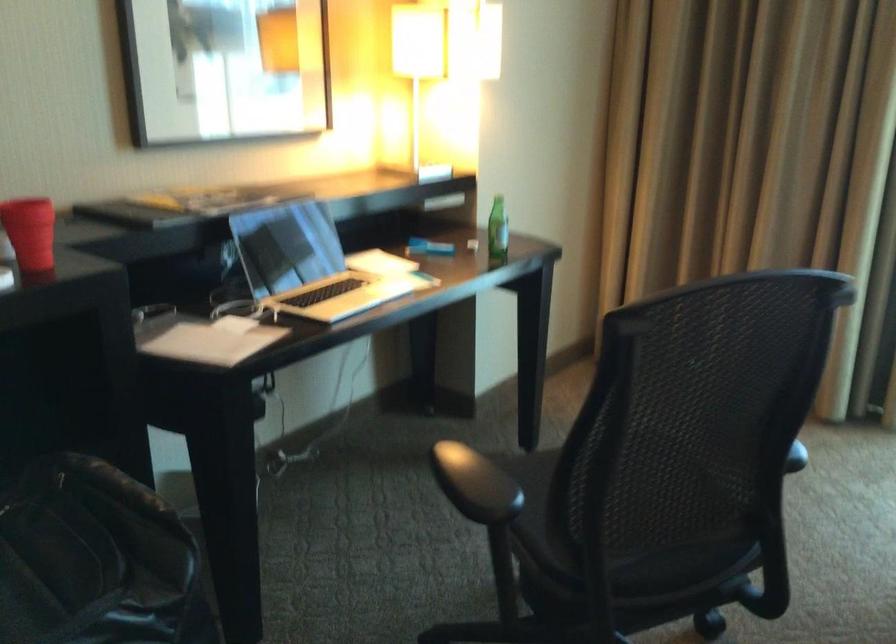
The height and width of the screenshot is (644, 896). Find the location of `chair sitting surface`. chair sitting surface is located at coordinates (558, 480).